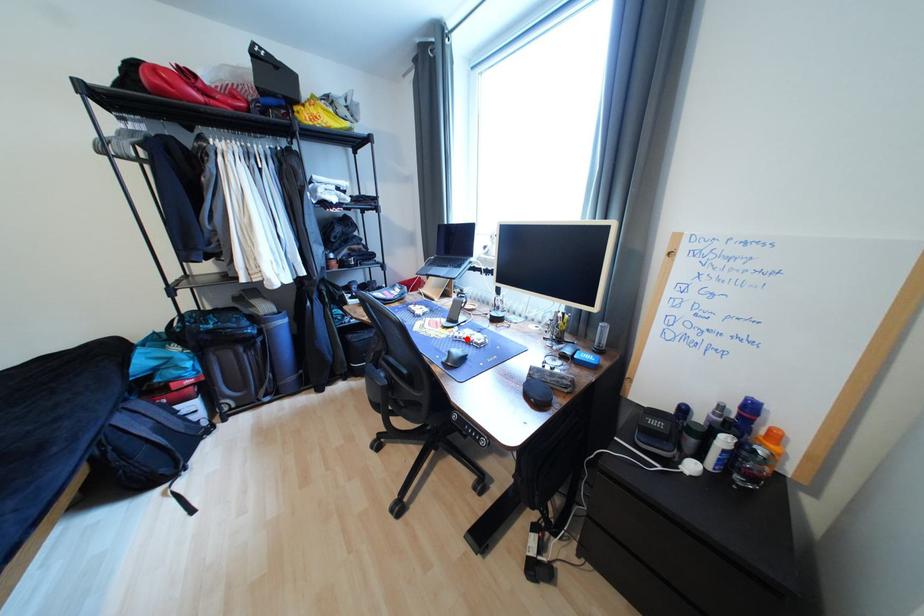
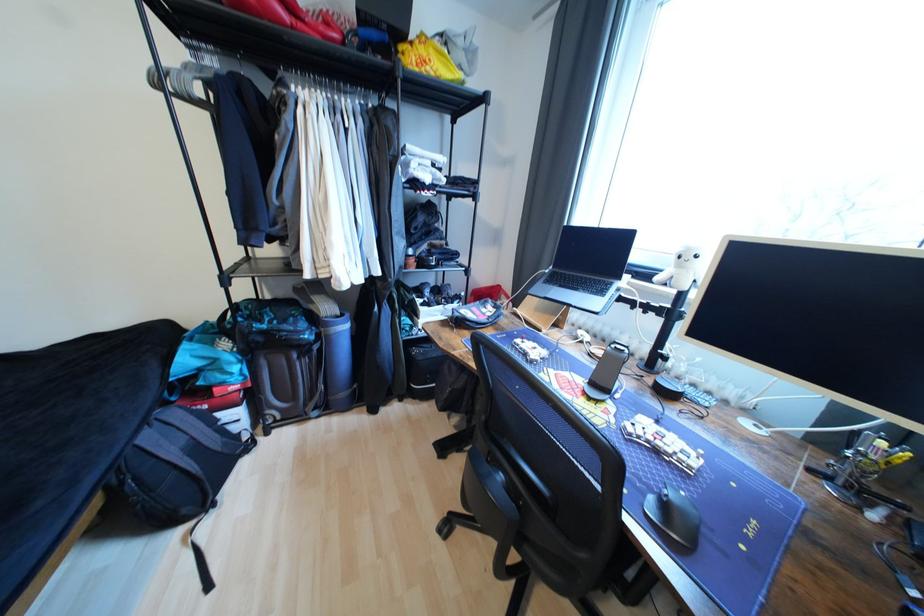
Find the pixel in the second image that matches the highlighted location in the first image.

(646, 438)